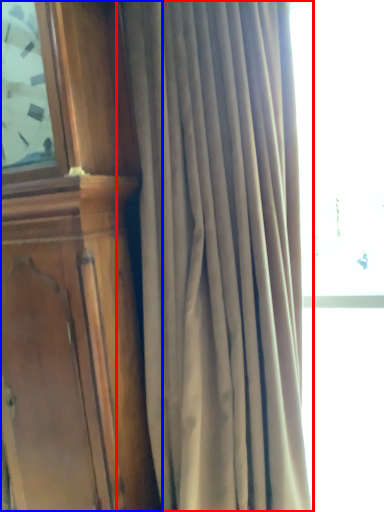
Question: Which of the following is the farthest to the observer, curtain (highlighted by a red box) or furniture (highlighted by a blue box)?

Choices:
 (A) curtain
 (B) furniture

Answer: (B)